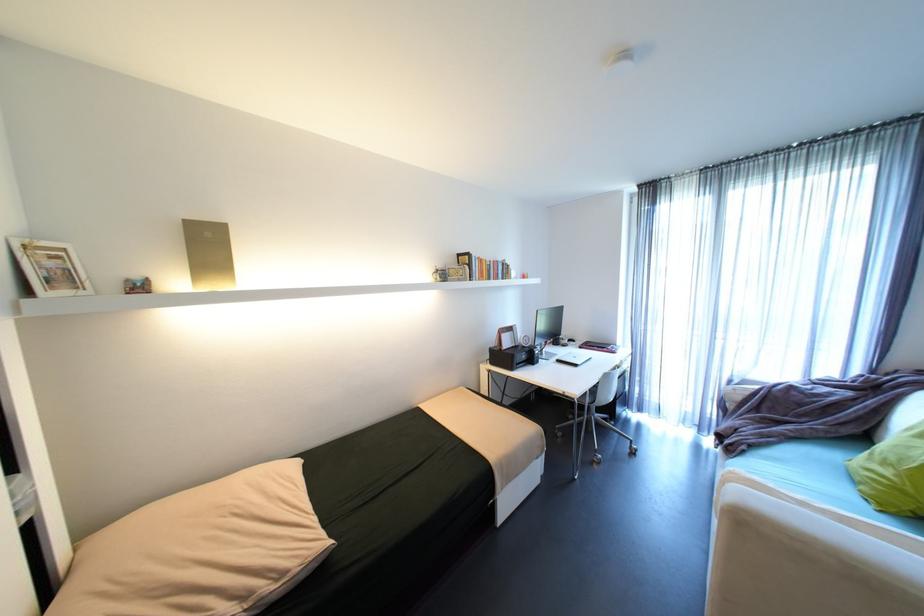
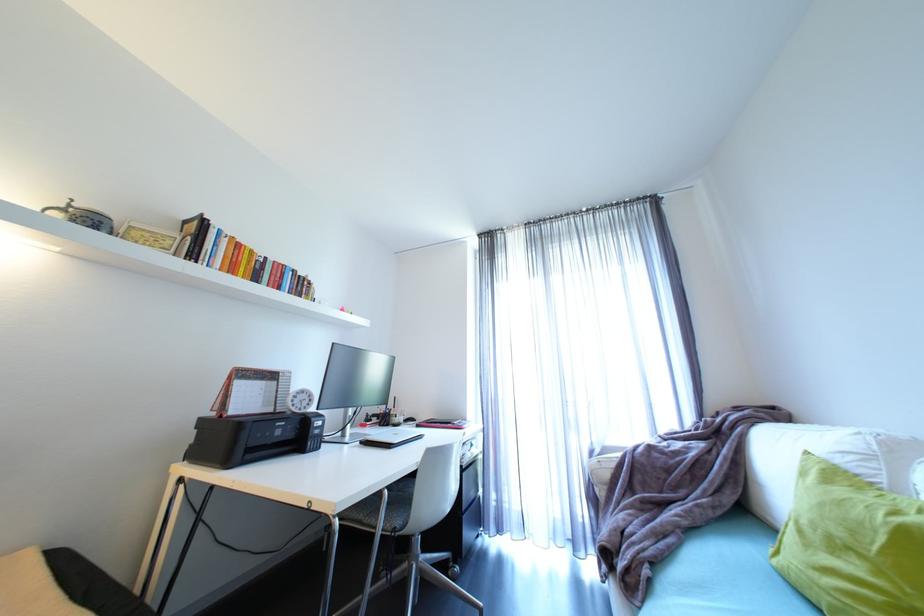
Find the pixel in the second image that matches point (750, 447) in the first image.

(653, 572)